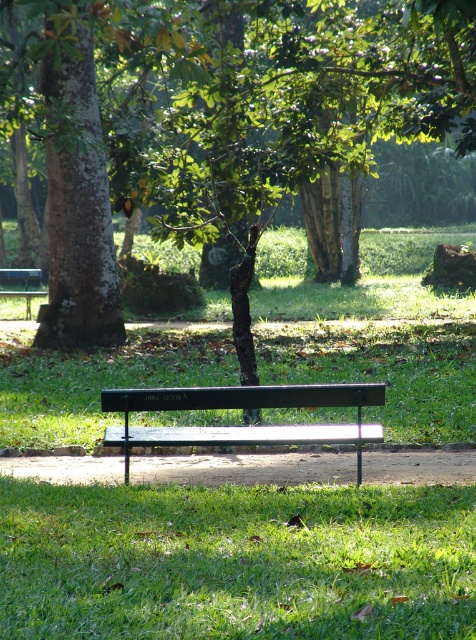
Can you confirm if green metallic bench at center is smaller than brown rough tree at center?

Correct, green metallic bench at center occupies less space than brown rough tree at center.

Is point (75, 392) in front of point (335, 38)?

Yes.

Is point (102, 618) farther from viewer compared to point (247, 74)?

No, (102, 618) is closer to viewer.

At what (x,y) coordinates should I click in order to perform the action: click on green metallic bench at center. Please return your answer as a coordinate pair (x, y). Looking at the image, I should click on (235, 563).

Is rough bark tree at left bigger than green matte bench at center?

Yes.

Is rough bark tree at left to the right of green matte bench at center from the viewer's perspective?

Yes, rough bark tree at left is to the right of green matte bench at center.

Between point (121, 342) and point (7, 294), which one is positioned behind?

Positioned behind is point (7, 294).

This screenshot has height=640, width=476. Identify the location of rough bark tree at left. (77, 192).

The height and width of the screenshot is (640, 476). What do you see at coordinates (236, 563) in the screenshot?
I see `green grass at lower center` at bounding box center [236, 563].

Is point (175, 602) more distant than point (32, 269)?

That is False.

Identify the location of green grass at lower center. The height and width of the screenshot is (640, 476). (236, 563).